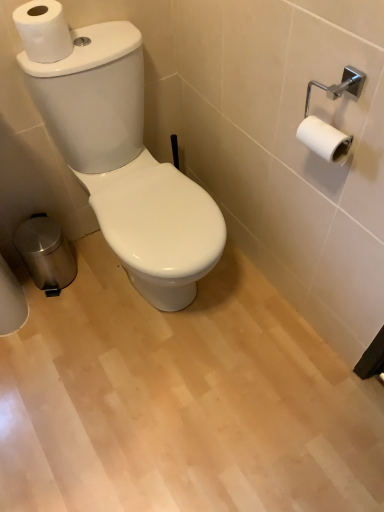
The image size is (384, 512). In order to click on unoccupied region to the right of white matte toilet paper at upper left in this screenshot , I will do `click(99, 46)`.